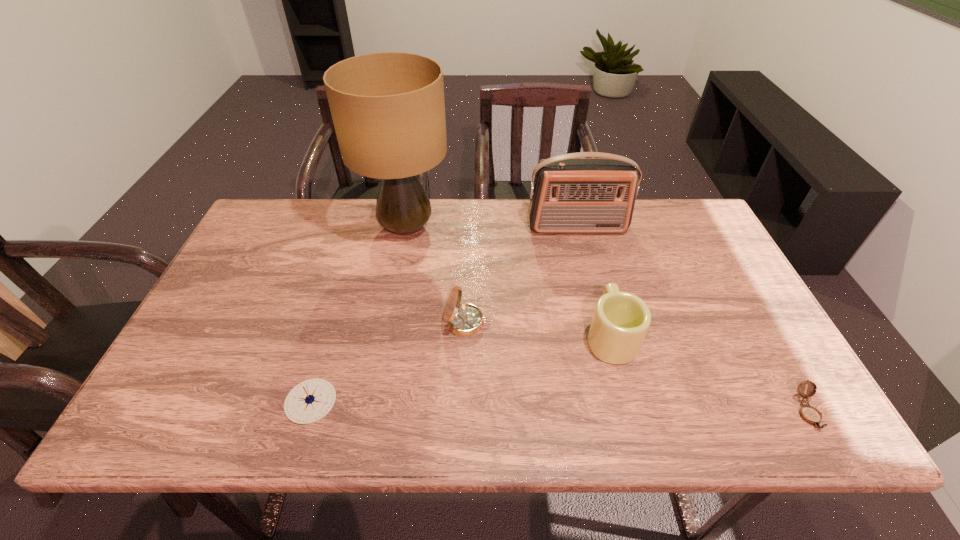
Identify which object is located as the fifth nearest to the mug. Please provide its 2D coordinates. Your answer should be formatted as a tuple, i.e. [(x, y)], where the tuple contains the x and y coordinates of a point satisfying the conditions above.

[(311, 400)]

The image size is (960, 540). I want to click on object that can be found as the closest to the mug, so click(464, 320).

Locate which compass ranks in proximity to the rightmost object. Please provide its 2D coordinates. Your answer should be formatted as a tuple, i.e. [(x, y)], where the tuple contains the x and y coordinates of a point satisfying the conditions above.

[(464, 320)]

Identify the location of compass that can be found as the third closest to the fifth shortest object. (311, 400).

Locate an element on the screen. The image size is (960, 540). vacant space that satisfies the following two spatial constraints: 1. with the handle on the side of the mug; 2. with the dial facing the tallest compass is located at coordinates (607, 323).

You are a GUI agent. You are given a task and a screenshot of the screen. Output one action in this format:
    pyautogui.click(x=<x>, y=<y>)
    Task: Click on the vacant area in the image that satisfies the following two spatial constraints: 1. with the dial facing the farthest compass; 2. with the handle on the side of the mug
    
    Given the screenshot: What is the action you would take?
    pyautogui.click(x=467, y=335)

Identify the location of free space that satisfies the following two spatial constraints: 1. with the handle on the side of the mug; 2. with the dial facing the second compass from left to right. (607, 323).